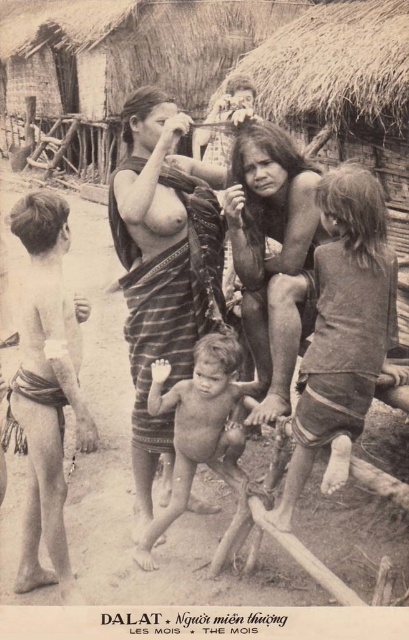
At what (x,y) coordinates should I click in order to perform the action: click on dark brown fabric shorts at center. Please return your answer as a coordinate pair (x, y). The image size is (409, 640). Looking at the image, I should click on (343, 323).

Who is positioned more to the right, dark brown fabric shorts at center or light brown skin at left?

Positioned to the right is dark brown fabric shorts at center.

Who is more distant from viewer, (341, 259) or (40, 584)?

The point (40, 584) is behind.

Identify the location of dark brown fabric shorts at center. (343, 323).

This screenshot has width=409, height=640. What do you see at coordinates (343, 323) in the screenshot?
I see `dark brown fabric shorts at center` at bounding box center [343, 323].

Can you confirm if dark brown fabric shorts at center is wider than naked skin child at center?

Incorrect, dark brown fabric shorts at center's width does not surpass naked skin child at center's.

This screenshot has height=640, width=409. Find the location of `dark brown fabric shorts at center`. dark brown fabric shorts at center is located at coordinates (343, 323).

You are a GUI agent. You are given a task and a screenshot of the screen. Output one action in this format:
    pyautogui.click(x=<x>, y=<y>)
    Task: Click on the dark brown fabric shorts at center
    
    Given the screenshot: What is the action you would take?
    click(343, 323)

Locate an element on the screen. The image size is (409, 640). light brown skin at left is located at coordinates (45, 387).

Based on the photo, who is positioned more to the right, light brown skin at left or naked skin child at center?

Positioned to the right is naked skin child at center.

I want to click on light brown skin at left, so click(x=45, y=387).